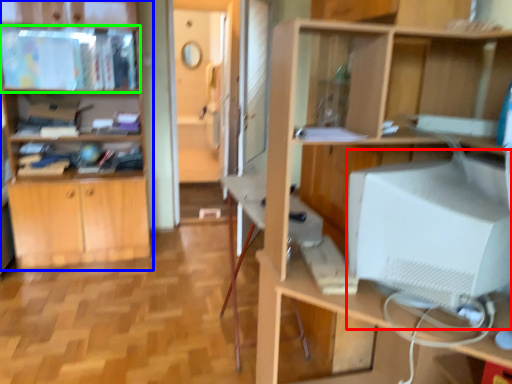
Question: Which object is positioned farthest from computer monitor (highlighted by a red box)? Select from cabinetry (highlighted by a blue box) and cabinet (highlighted by a green box).

Choices:
 (A) cabinetry
 (B) cabinet

Answer: (B)